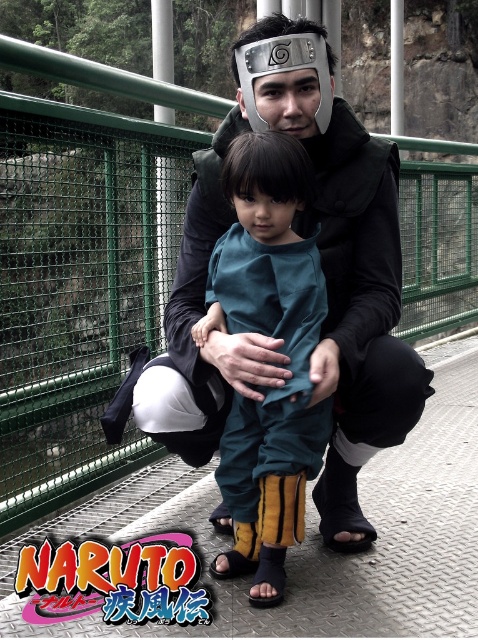
Question: Which point is farther to the camera?

Choices:
 (A) (238, 284)
 (B) (249, 42)

Answer: (B)

Question: Is teal fabric pants at center wider than metallic silver headband at center?

Choices:
 (A) no
 (B) yes

Answer: (B)

Question: Which object is closer to the camera taking this photo?

Choices:
 (A) teal fabric pants at center
 (B) metallic silver headband at center

Answer: (A)

Question: Can you confirm if teal fabric pants at center is positioned to the right of metallic silver headband at center?

Choices:
 (A) yes
 (B) no

Answer: (B)

Question: Which point appears closest to the camera in this image?

Choices:
 (A) (294, 68)
 (B) (276, 141)

Answer: (B)

Question: Can you confirm if teal fabric pants at center is positioned to the right of metallic silver headband at center?

Choices:
 (A) no
 (B) yes

Answer: (A)